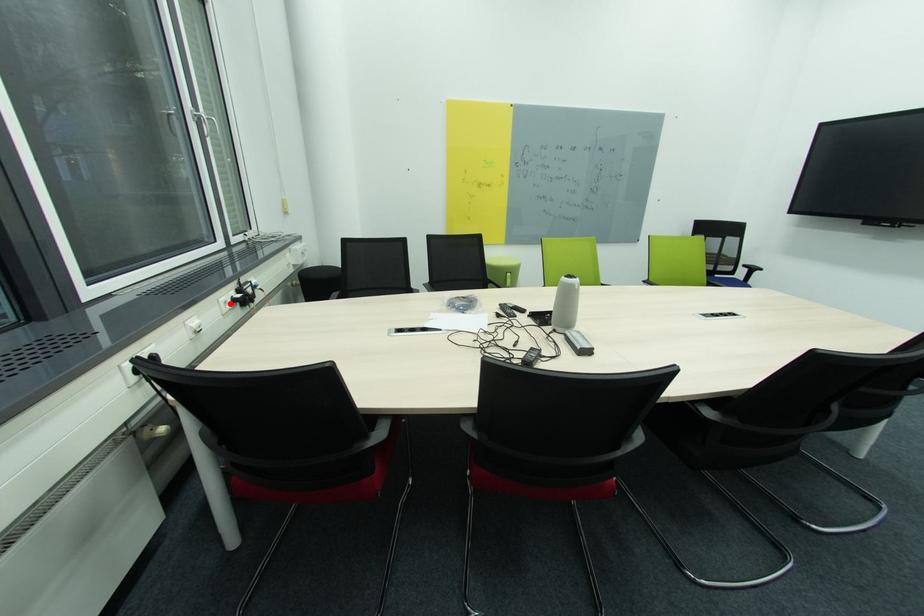
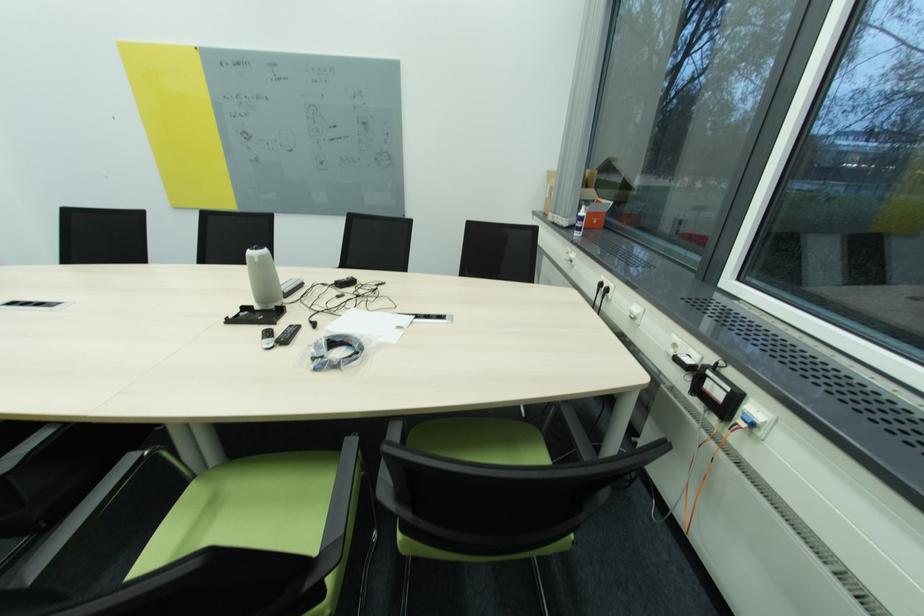
Question: I am providing you with two images of the same scene from different viewpoints. A red point is marked on the first image. Is the red point's position out of view in image 2?

Choices:
 (A) Yes
 (B) No

Answer: (B)